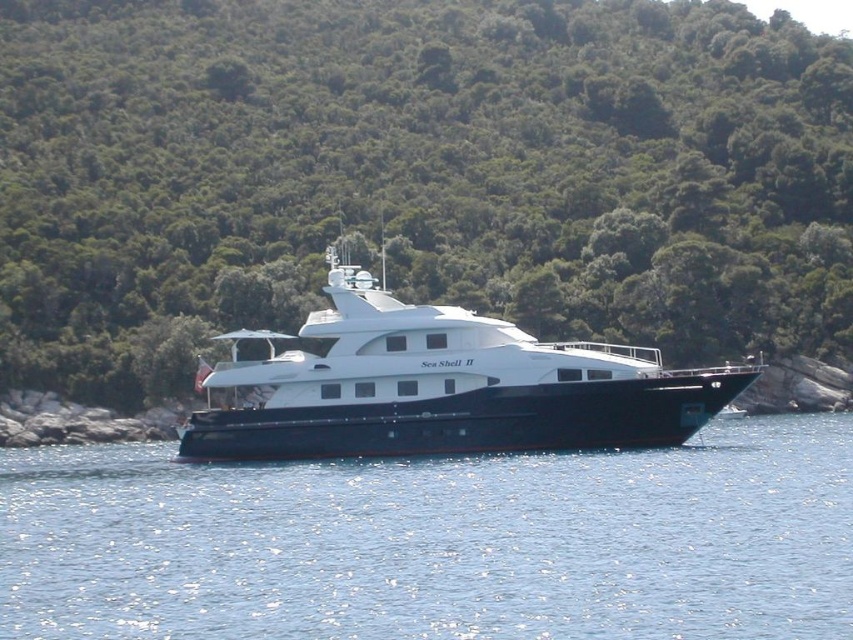
You are a passenger on the white glossy cruise ship at center and want to take a photo of the green leafy trees at center. Since the trees are above the ship, where should you position yourself on the ship to get a clear view of them?

The green leafy trees at center are located above the white glossy cruise ship at center, so you should position yourself on the upper deck or a higher vantage point on the ship to get a clear view of the trees.

In the scene shown: You are a photographer on the deck of the yacht and want to capture a shot that includes both the green leafy trees at center and the blue water at center. Which object should you position closer to the top of your camera frame?

You should position the green leafy trees at center closer to the top of your camera frame since it is located above the blue water at center.

You are standing on the deck of the Sea Shell II yacht and want to reach a specific point marked at coordinates point (660, 246). Considering the yacht is 10 meters long, can you walk directly to that point from your current position?

The distance between you and point (660, 246) is 107.95 meters, which is much greater than the yacht length of 10 meters. Therefore, you cannot walk directly to that point from your current position on the yacht.